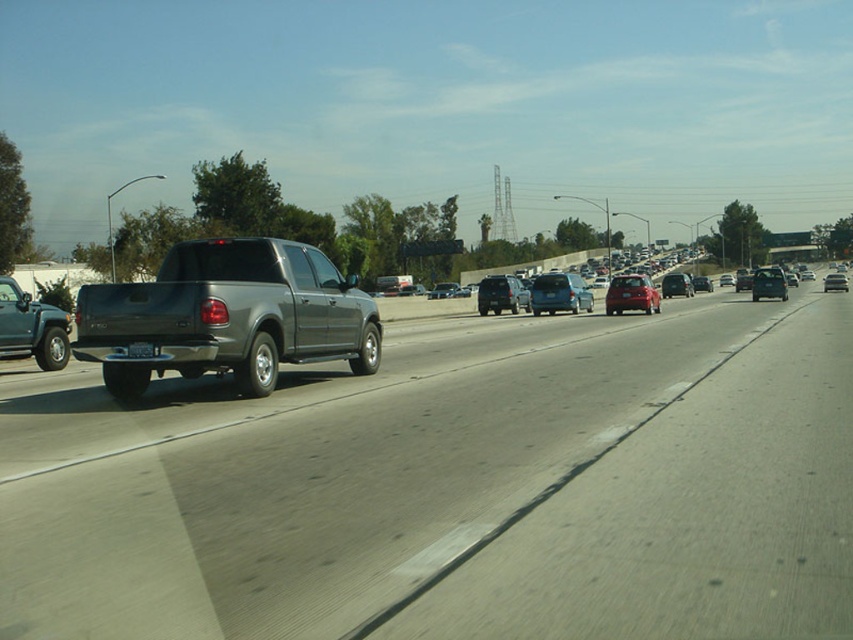
Question: Which of the following is the closest to the observer?

Choices:
 (A) shiny black sedan at right
 (B) metallic gray pickup truck at center
 (C) shiny red sedan at center

Answer: (B)

Question: Which object is the farthest from the metallic silver sedan at center?

Choices:
 (A) metallic gray pickup truck at center
 (B) matte blue sedan at center
 (C) metallic gray sedan at center
 (D) matte gray truck at center

Answer: (A)

Question: Is metallic gray sedan at center further to the viewer compared to black plastic license plate at rear?

Choices:
 (A) yes
 (B) no

Answer: (A)

Question: From the image, what is the correct spatial relationship of satin black suv at center in relation to metallic gray sedan at center?

Choices:
 (A) above
 (B) below

Answer: (B)

Question: Is shiny red sedan at center below shiny black sedan at right?

Choices:
 (A) yes
 (B) no

Answer: (A)

Question: Which point is closer to the camera?

Choices:
 (A) metallic gray sedan at center
 (B) satin black suv at center

Answer: (B)